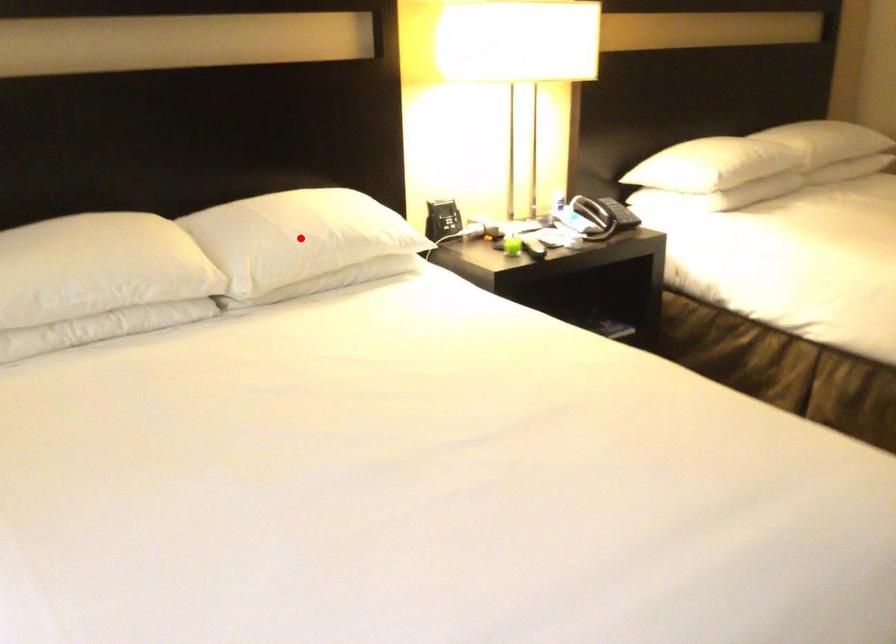
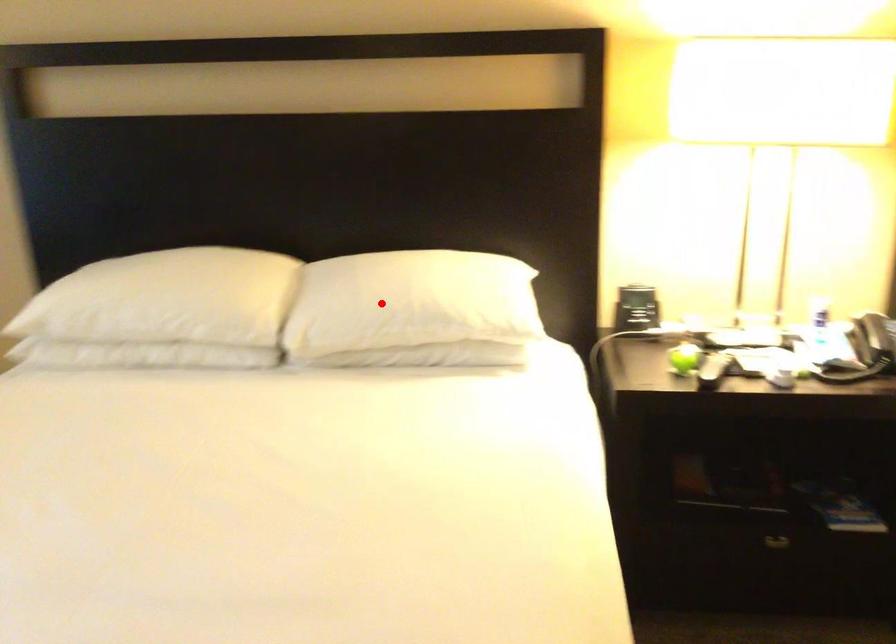
I am providing you with two images of the same scene from different viewpoints. A red point is marked on the first image and another point is marked on the second image. Do the highlighted points in image1 and image2 indicate the same real-world spot?

Yes